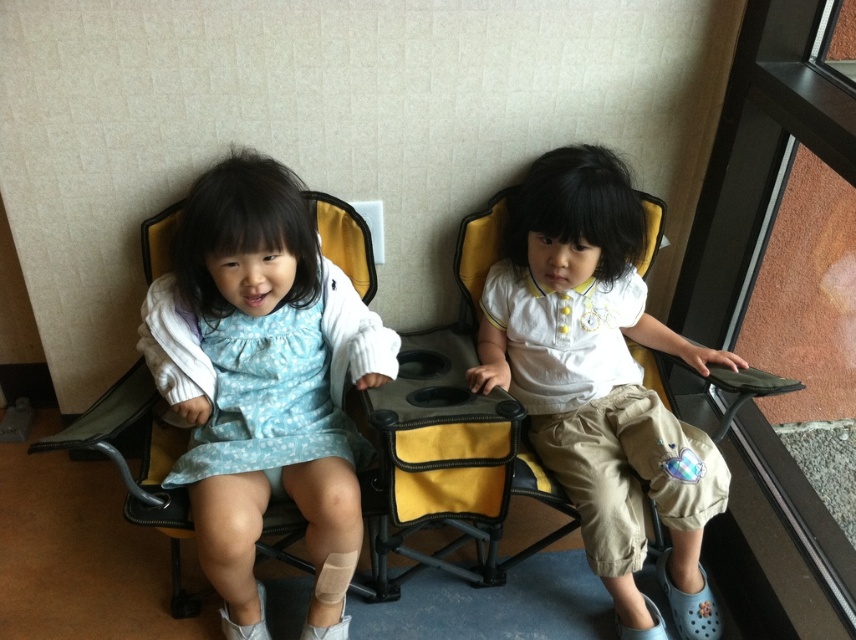
You are a photographer setting up for a family portrait. You notice the matte blue dress at center and the white cotton shirt at center in the image. Which clothing item is positioned higher from the ground?

The matte blue dress at center is located above the white cotton shirt at center, so it is positioned higher from the ground.

You are a photographer trying to capture a closeup of the bandaged leg of the girl in the light blue dress. The bandaged leg is at point (391, 360). There is another point at (595, 436). Which point should you focus on to get the clearest image of the bandaged leg?

You should focus on point (391, 360) because it is closer to the camera than point (595, 436), ensuring a clearer closeup of the bandaged leg.